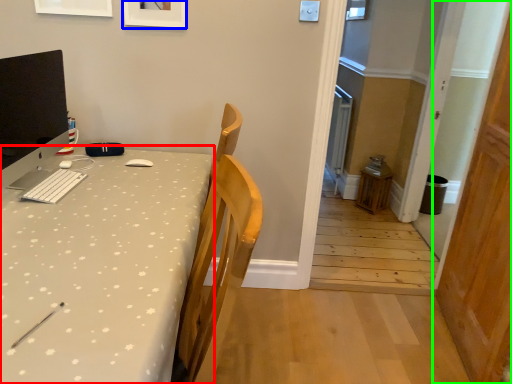
Question: Which is farther away from desk (highlighted by a red box)? picture frame (highlighted by a blue box) or door (highlighted by a green box)?

Choices:
 (A) picture frame
 (B) door

Answer: (B)